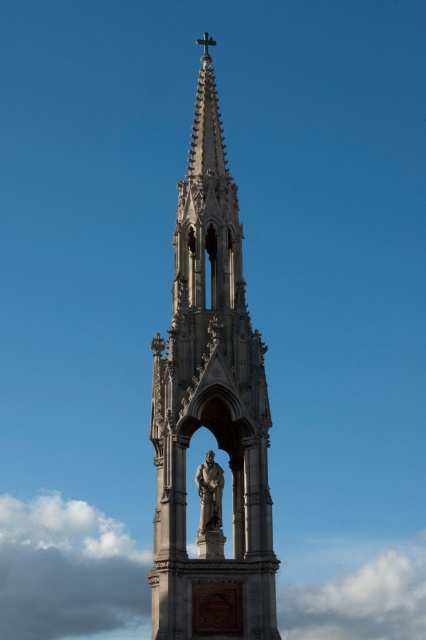
You are standing in front of a stone Gothic tower with a cross at the top. There is a point marked at coordinates [210,408]. Based on the scene description, can you determine what structure this point is located on?

The point at [210,408] is located on the stone Gothic tower at center.

You are an architect planning to place a new decorative element between the stone gothic tower at center and the bronze statue at center. Based on their widths, which object should you consider moving closer to the other to ensure the decorative element fits comfortably between them?

The stone gothic tower at center might be wider than the bronze statue at center, so to fit the decorative element comfortably between them, you should move the bronze statue at center closer to the stone gothic tower at center.